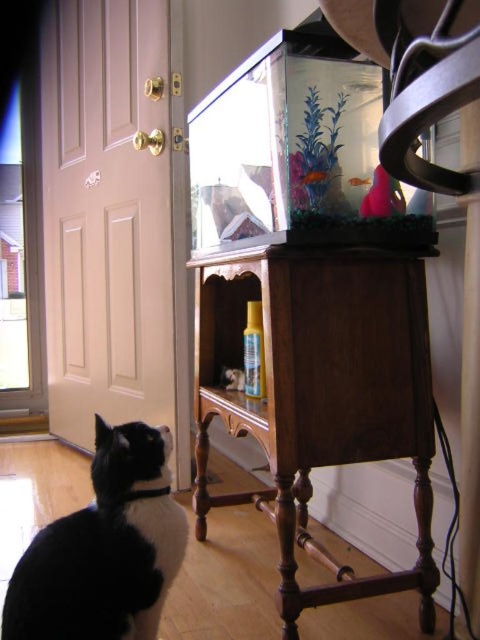
Is wooden at center taller than translucent glass fish at center?

Yes.

Can you confirm if wooden at center is shorter than translucent glass fish at center?

Incorrect, wooden at center's height does not fall short of translucent glass fish at center's.

Does point (316, 276) lie behind point (299, 173)?

Yes.

You are a GUI agent. You are given a task and a screenshot of the screen. Output one action in this format:
    pyautogui.click(x=<x>, y=<y>)
    Task: Click on the wooden at center
    The width and height of the screenshot is (480, 640).
    Given the screenshot: What is the action you would take?
    pyautogui.click(x=322, y=380)

Is point (17, 595) positioned after point (365, 179)?

No, it is not.

Between point (146, 486) and point (365, 177), which one is positioned in front?

Point (146, 486)

At what (x,y) coordinates should I click in order to perform the action: click on black fur cat at lower left. Please return your answer as a coordinate pair (x, y). This screenshot has width=480, height=640. Looking at the image, I should click on (105, 548).

Between matte white door at left and translucent glass fish at center, which one appears on the right side from the viewer's perspective?

translucent glass fish at center is more to the right.

Is point (116, 308) closer to camera compared to point (320, 182)?

No, it is behind (320, 182).

I want to click on matte white door at left, so click(112, 218).